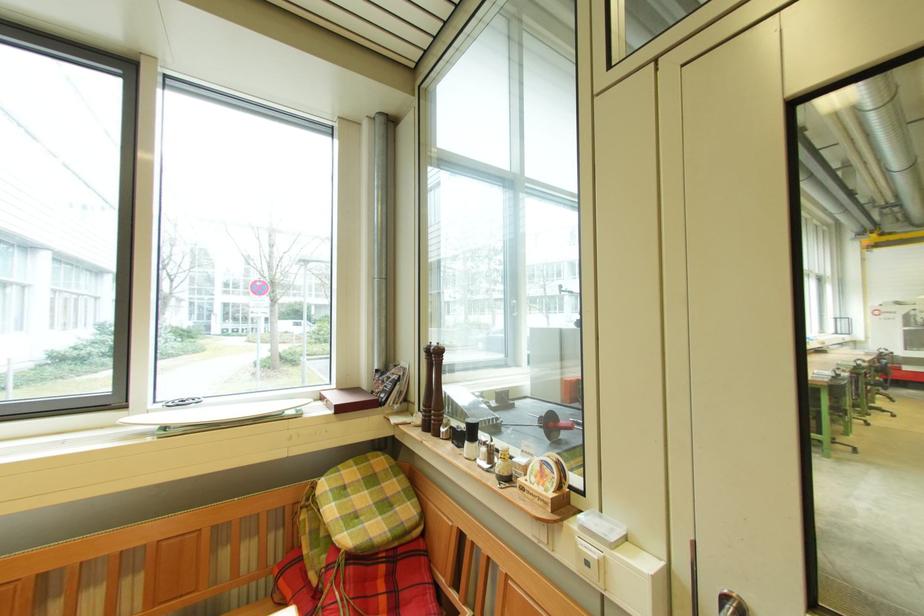
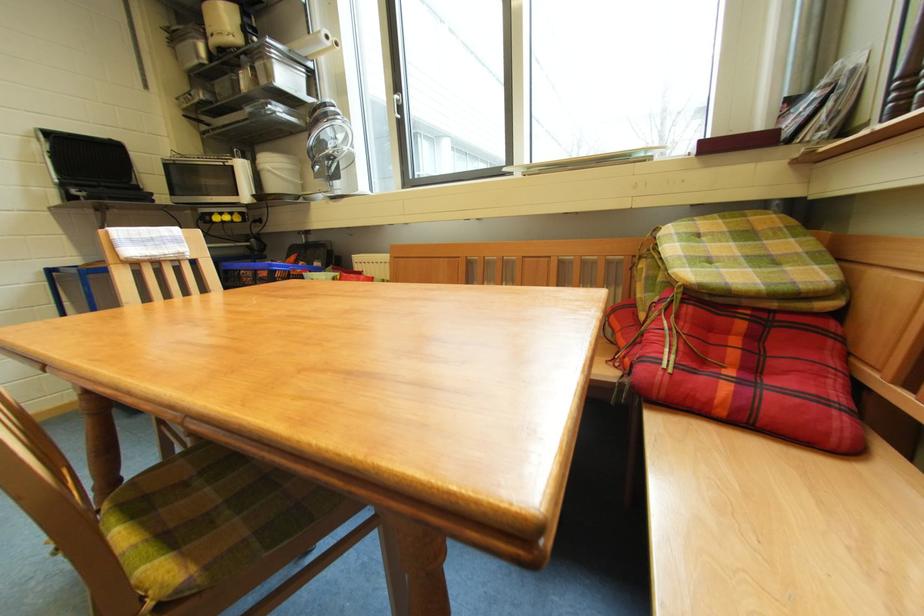
Question: The first image is from the beginning of the video and the second image is from the end. How did the camera likely rotate when shooting the video?

Choices:
 (A) Left
 (B) Right
 (C) Up
 (D) Down

Answer: (A)